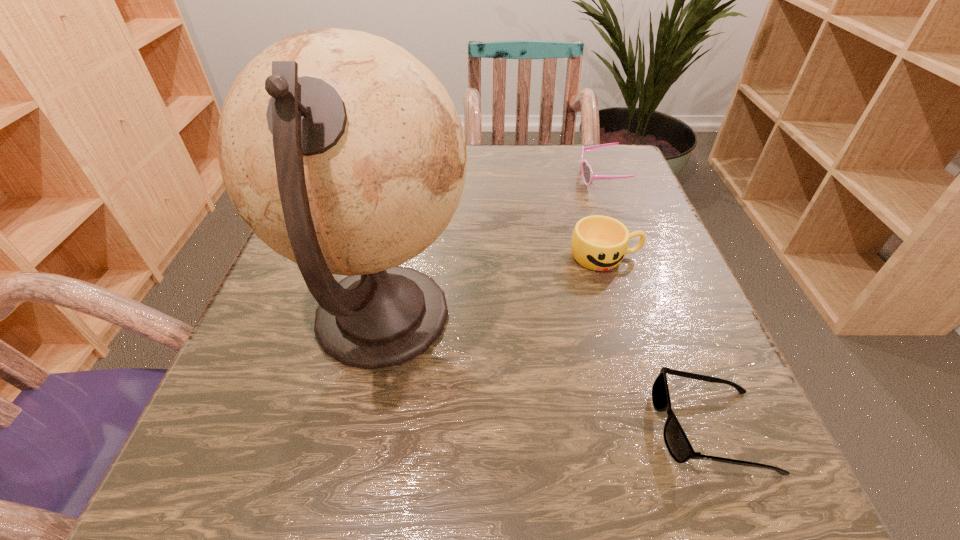
Locate an element on the screen. This screenshot has height=540, width=960. globe is located at coordinates (342, 152).

Image resolution: width=960 pixels, height=540 pixels. Find the location of `the tallest object`. the tallest object is located at coordinates (342, 152).

This screenshot has width=960, height=540. Identify the location of cup. (599, 243).

The width and height of the screenshot is (960, 540). What are the coordinates of `the farther sunglasses` in the screenshot? It's located at (587, 173).

Where is `the shortest object`? the shortest object is located at coordinates (677, 443).

I want to click on the nearer sunglasses, so click(677, 443).

Where is `vacant space located on the front-facing side of the tallest object`? This screenshot has height=540, width=960. vacant space located on the front-facing side of the tallest object is located at coordinates (627, 318).

Identify the location of free space located 0.060m on the back of the cup. The height and width of the screenshot is (540, 960). (593, 220).

The height and width of the screenshot is (540, 960). I want to click on vacant space located 0.250m on the front-facing side of the farther sunglasses, so click(x=469, y=178).

Where is `vacant region located 0.070m on the front-facing side of the farther sunglasses`? vacant region located 0.070m on the front-facing side of the farther sunglasses is located at coordinates (548, 178).